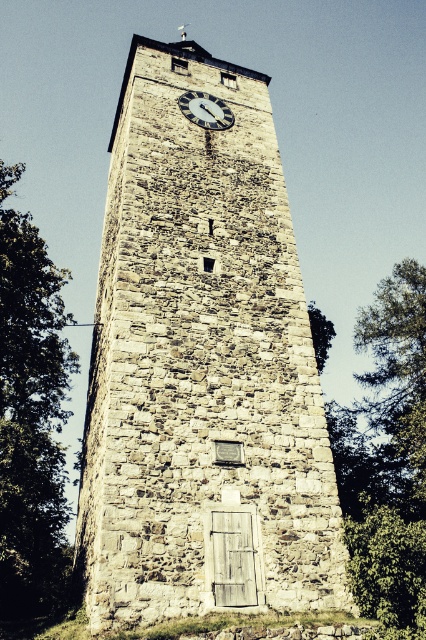
Question: Does green leafy tree at right lie in front of white stone clock at upper center?

Choices:
 (A) yes
 (B) no

Answer: (A)

Question: Which point appears closest to the camera in this image?

Choices:
 (A) tap(359, 433)
 (B) tap(213, 106)
 (C) tap(317, 333)
 (D) tap(42, 348)

Answer: (B)

Question: Which of the following is the farthest from the observer?

Choices:
 (A) green leafy tree at left
 (B) green leafy tree at center
 (C) white stone clock at upper center

Answer: (C)

Question: Does green leafy tree at right appear over white stone clock at upper center?

Choices:
 (A) yes
 (B) no

Answer: (B)

Question: Which object is positioned closest to the white stone clock at upper center?

Choices:
 (A) green leafy tree at center
 (B) stone clock tower at center
 (C) green leafy tree at left

Answer: (B)

Question: Can you confirm if green leafy tree at left is positioned above white stone clock at upper center?

Choices:
 (A) yes
 (B) no

Answer: (B)